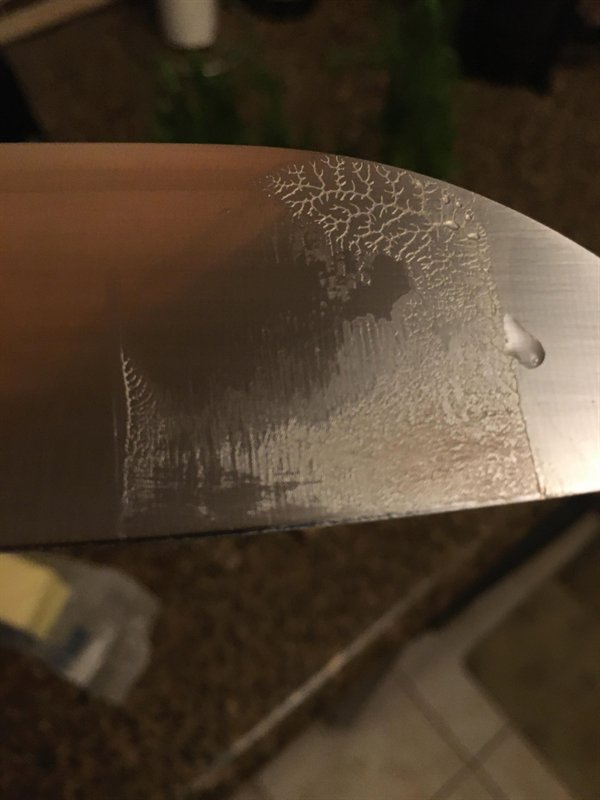
This screenshot has width=600, height=800. I want to click on blurred wall, so click(557, 700).